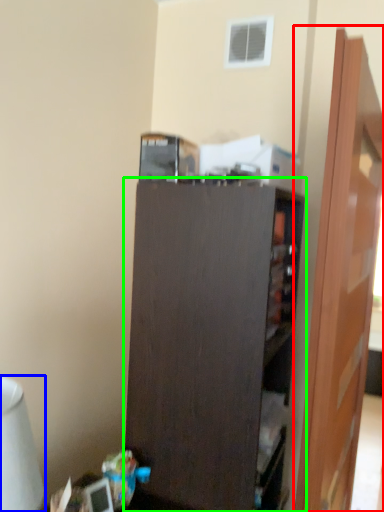
Question: Which object is the farthest from door (highlighted by a red box)? Choose among these: table lamp (highlighted by a blue box) or cupboard (highlighted by a green box).

Choices:
 (A) table lamp
 (B) cupboard

Answer: (A)